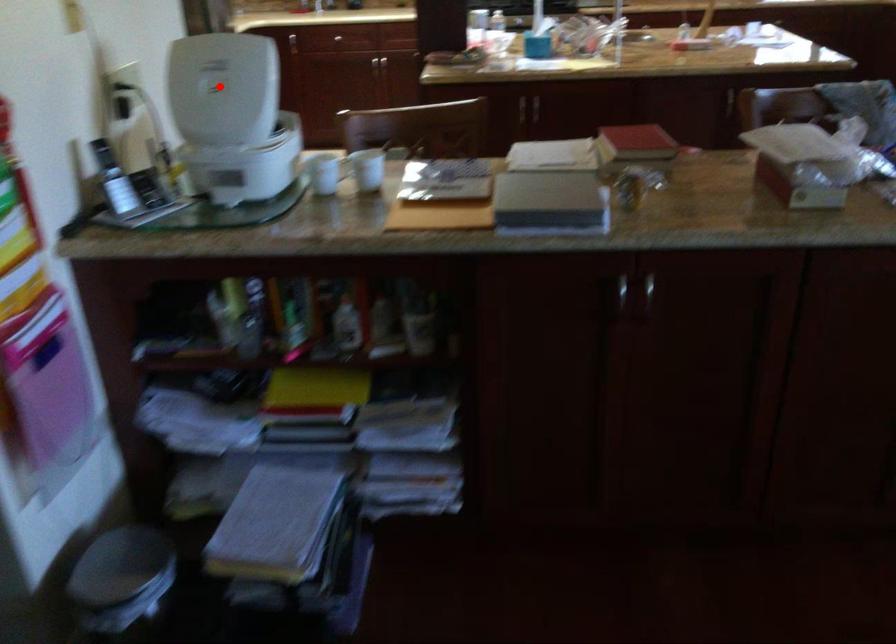
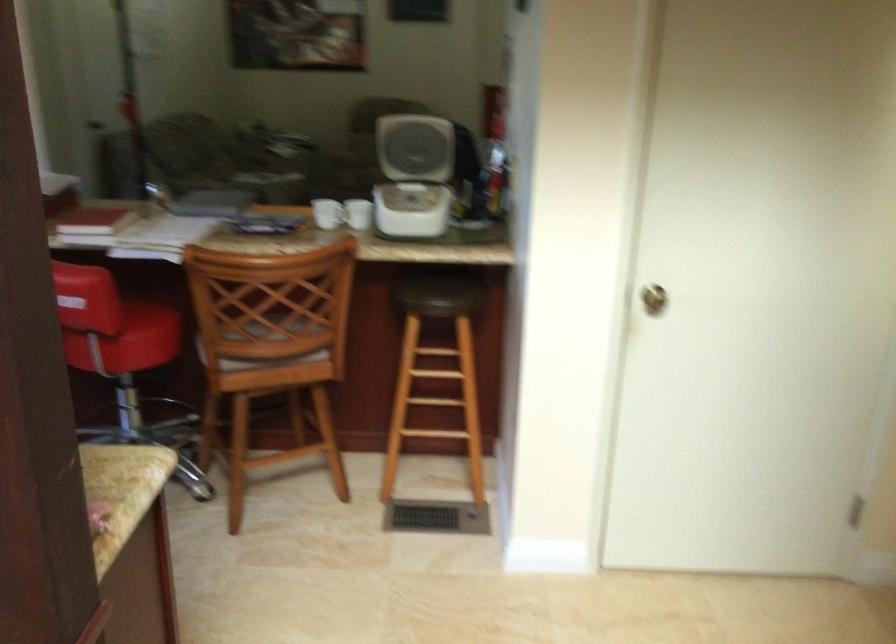
Find the pixel in the second image that matches the highlighted location in the first image.

(416, 137)